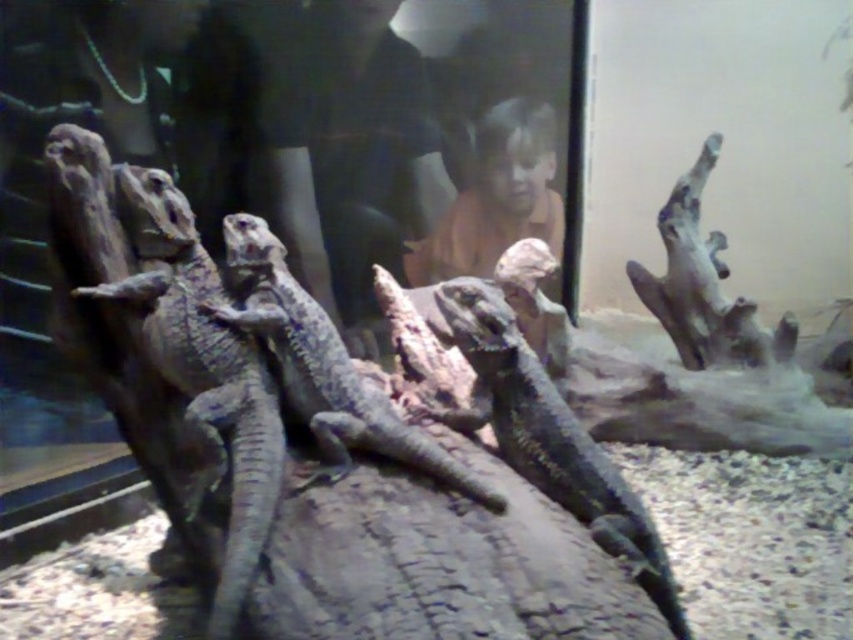
Question: Is scaly gray lizard at left bigger than shiny black lizard at center?

Choices:
 (A) yes
 (B) no

Answer: (A)

Question: Which is farther from the shiny black lizard at center?

Choices:
 (A) scaly gray lizard at center
 (B) scaly gray lizard at left

Answer: (B)

Question: Estimate the real-world distances between objects in this image. Which object is closer to the shiny black lizard at center?

Choices:
 (A) scaly gray lizard at left
 (B) scaly gray lizard at center

Answer: (B)

Question: Which point appears closest to the camera in this image?

Choices:
 (A) (578, 492)
 (B) (230, 337)

Answer: (B)

Question: Does scaly gray lizard at left appear on the right side of shiny black lizard at center?

Choices:
 (A) yes
 (B) no

Answer: (B)

Question: From the image, what is the correct spatial relationship of shiny black lizard at center in relation to scaly gray lizard at center?

Choices:
 (A) above
 (B) below

Answer: (B)